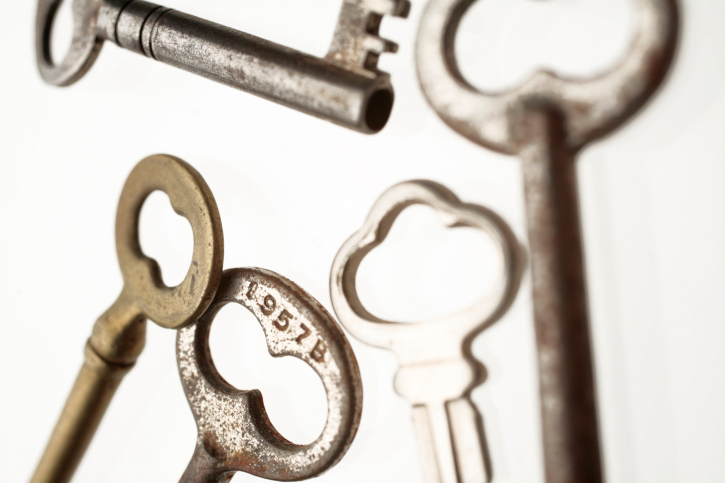
Identify the location of keys. The width and height of the screenshot is (725, 483). (160, 291), (278, 302), (341, 274), (536, 103), (357, 43).